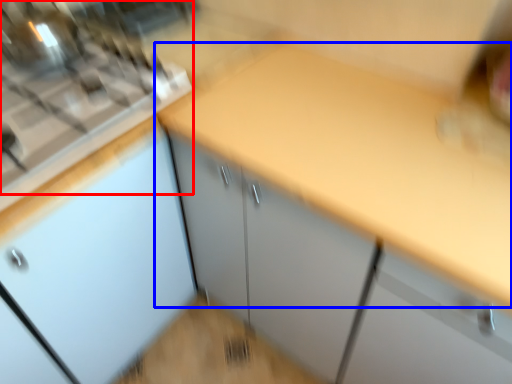
Question: Among these objects, which one is farthest to the camera, gas stove (highlighted by a red box) or countertop (highlighted by a blue box)?

Choices:
 (A) gas stove
 (B) countertop

Answer: (A)